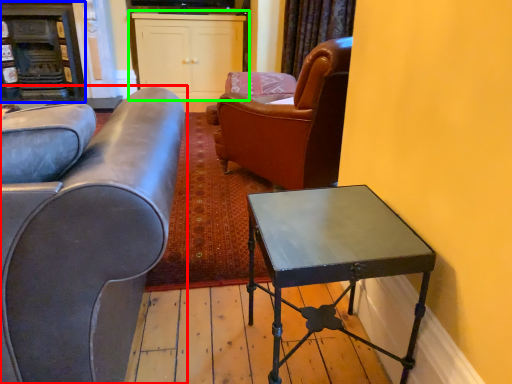
Question: Which object is positioned farthest from studio couch (highlighted by a red box)? Select from fireplace (highlighted by a blue box) and cabinetry (highlighted by a green box).

Choices:
 (A) fireplace
 (B) cabinetry

Answer: (A)